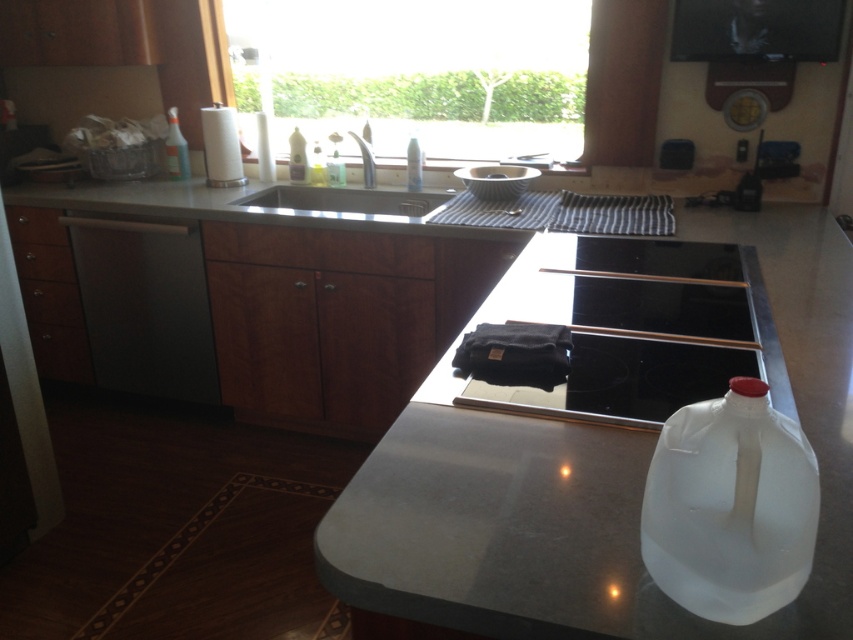
You are standing in the kitchen and need to reach both the point at coordinates (415, 205) and the point at coordinates (305, 140). Which point should you approach first if you want to reach the one that is closer to you?

Point (305, 140) is closer to you than point (415, 205), so you should approach point (305, 140) first.

You are a kitchen assistant who needs to place a new dish rack. The dish rack is taller than the clear plastic bottle at sink. Can the dish rack fit vertically in the stainless steel sink at center?

The stainless steel sink at center is not as tall as the clear plastic bottle at sink. Since the dish rack is taller than the clear plastic bottle at sink, it would also be taller than the sink, so it cannot fit vertically in the stainless steel sink at center.

You are organizing the kitchen and need to place a new spray bottle. The current transparent plastic spray bottle at upper left is already in use. Where should you place the new one so it doesn not block the satin silver sink at upper center?

Place the new spray bottle to the left of the transparent plastic spray bottle at upper left. This keeps it out of the way of the satin silver sink at upper center, which is already to the right of the existing spray bottle.